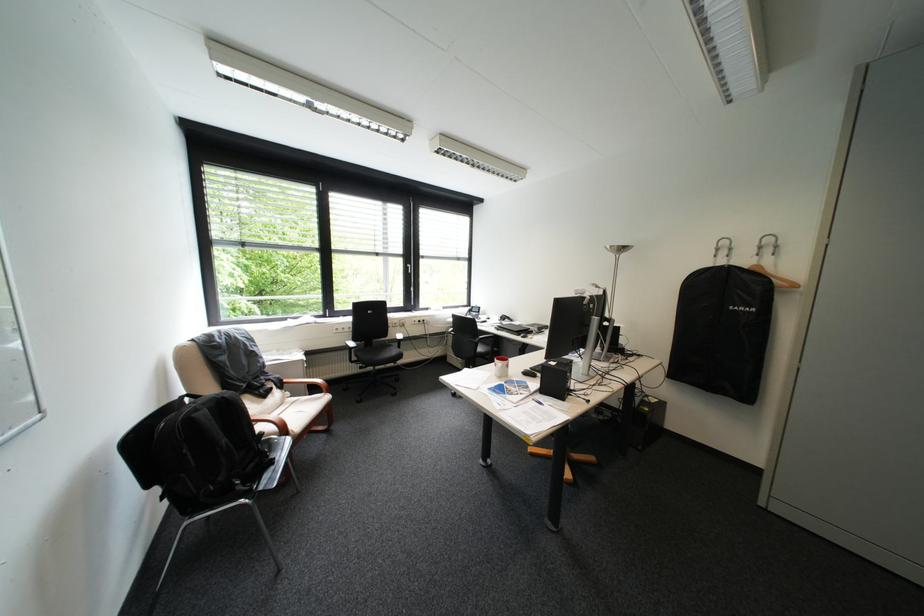
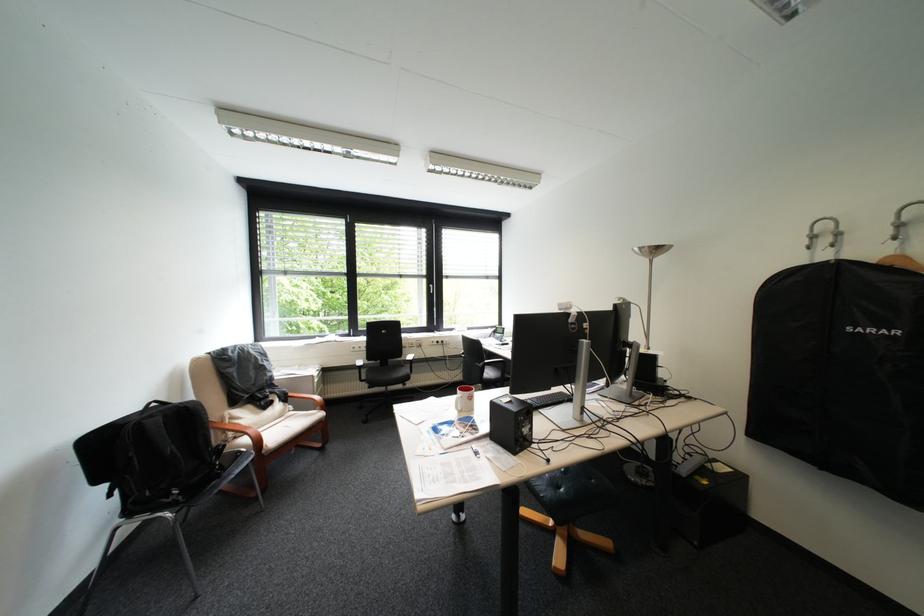
Find the pixel in the second image that matches [755,309] in the first image.

(883, 331)